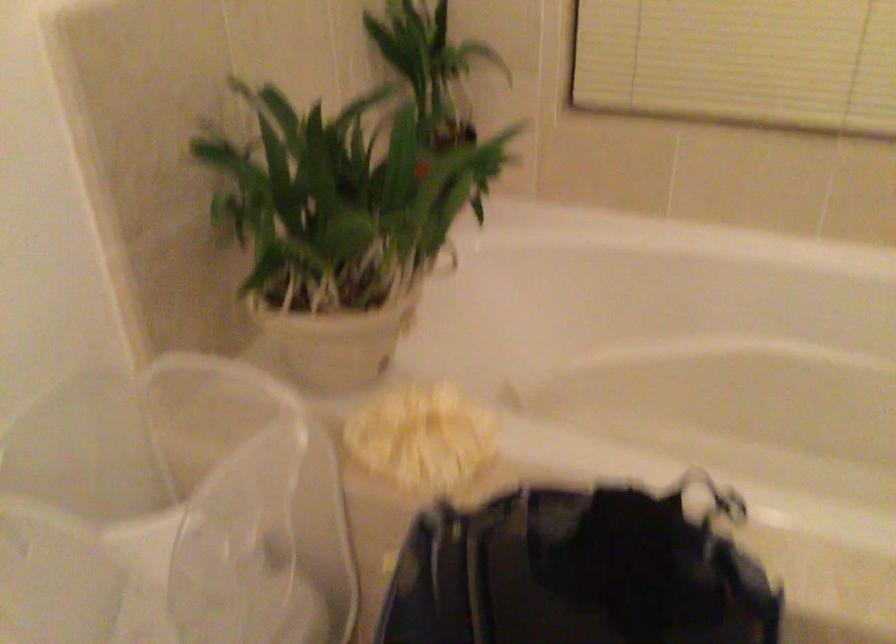
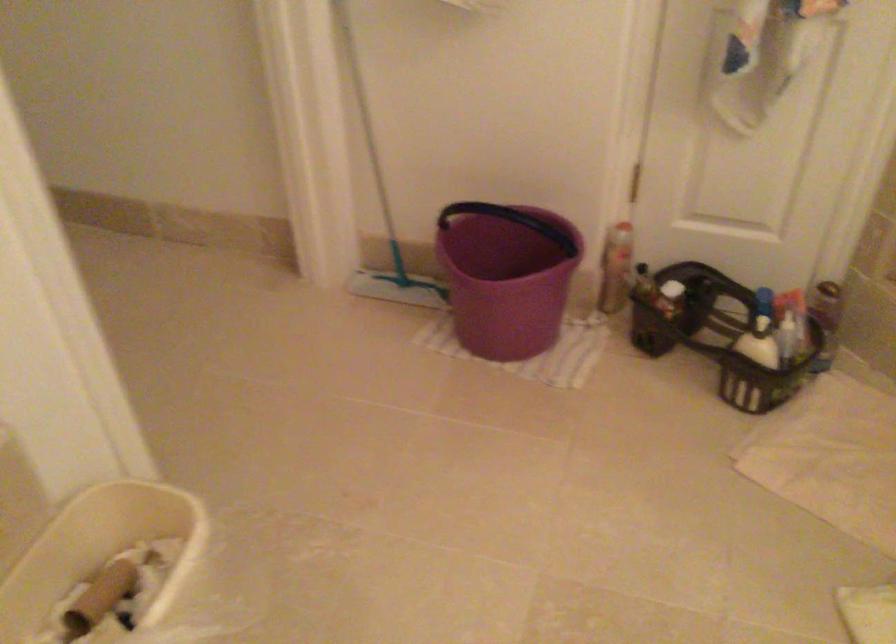
The images are taken continuously from a first-person perspective. In which direction is your viewpoint rotating?

The rotation direction of the camera is right-down.